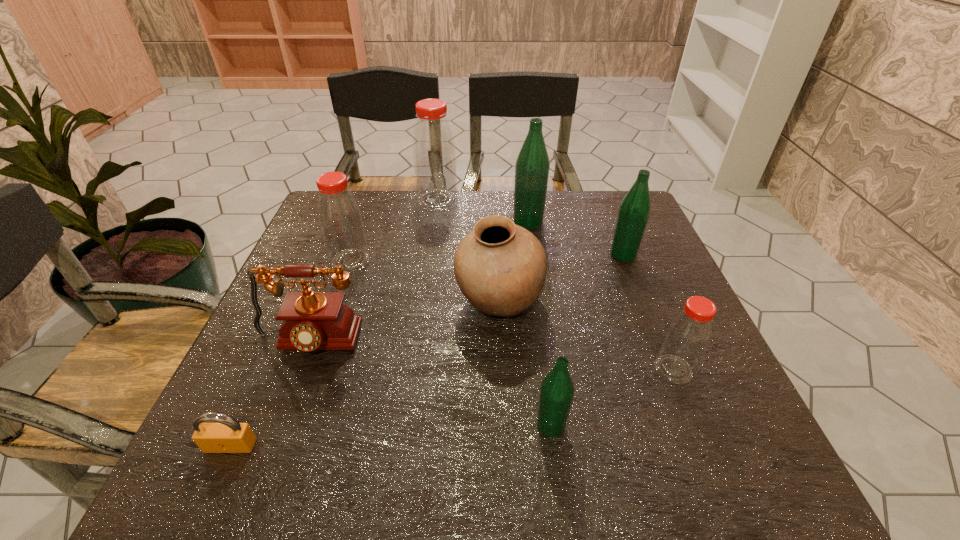
Identify the location of free space located on the dial of the telephone. (270, 444).

The width and height of the screenshot is (960, 540). In order to click on blank area located on the left of the second nearest bottle in this screenshot , I will do `click(605, 369)`.

Image resolution: width=960 pixels, height=540 pixels. Find the location of `vacant space situated 0.050m on the back of the nearest green bottle`. vacant space situated 0.050m on the back of the nearest green bottle is located at coordinates (546, 388).

I want to click on object situated at the near edge, so click(x=227, y=435).

Where is `bottle positioned at the left edge`? The width and height of the screenshot is (960, 540). bottle positioned at the left edge is located at coordinates (341, 223).

This screenshot has height=540, width=960. I want to click on telephone that is at the left edge, so click(x=312, y=321).

This screenshot has width=960, height=540. I want to click on padlock that is at the left edge, so click(227, 435).

You are a GUI agent. You are given a task and a screenshot of the screen. Output one action in this format:
    pyautogui.click(x=<x>, y=<y>)
    Task: Click on the object present at the near left corner
    
    Given the screenshot: What is the action you would take?
    pyautogui.click(x=227, y=435)

Identify the location of vacant area at the far edge of the desktop. (x=585, y=228).

You are a GUI agent. You are given a task and a screenshot of the screen. Output one action in this format:
    pyautogui.click(x=<x>, y=<y>)
    Task: Click on the free space at the near edge
    
    Given the screenshot: What is the action you would take?
    pyautogui.click(x=304, y=448)